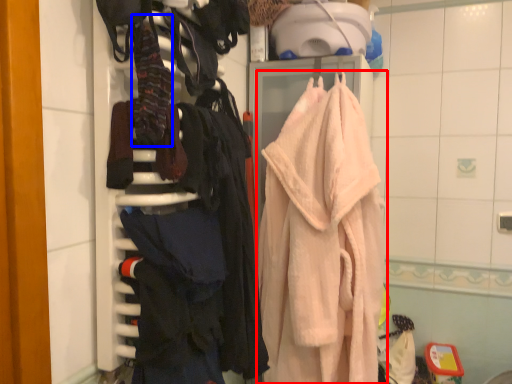
Question: Which point is further to the camera, towel (highlighted by a red box) or clothing (highlighted by a blue box)?

Choices:
 (A) towel
 (B) clothing

Answer: (A)